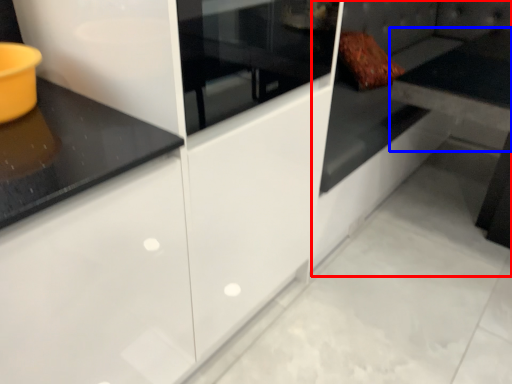
Question: Which of the following is the farthest to the observer, couch (highlighted by a red box) or table (highlighted by a blue box)?

Choices:
 (A) couch
 (B) table

Answer: (B)